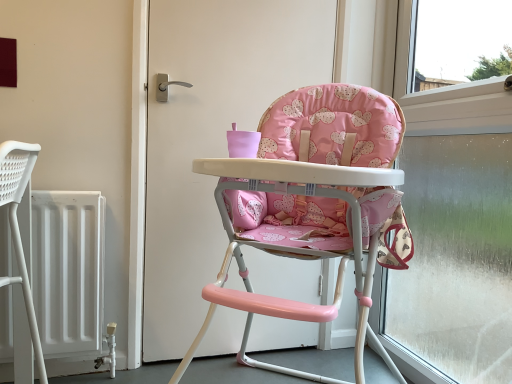
Question: Is point (286, 61) positioned closer to the camera than point (346, 175)?

Choices:
 (A) farther
 (B) closer

Answer: (A)

Question: From a real-world perspective, is white matte door at center physically located above or below pink fabric highchair at center?

Choices:
 (A) below
 (B) above

Answer: (B)

Question: Estimate the real-world distances between objects in this image. Which object is farther from the pink fabric highchair at center?

Choices:
 (A) transparent glass window at right
 (B) white matte door at center

Answer: (A)

Question: Which object is positioned farthest from the pink fabric highchair at center?

Choices:
 (A) white matte door at center
 (B) transparent glass window at right

Answer: (B)